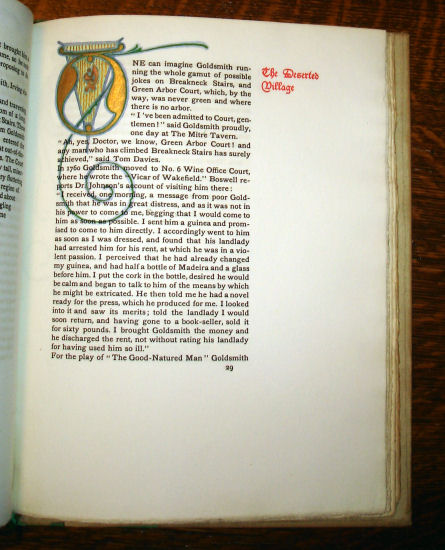
This screenshot has height=550, width=445. I want to click on table, so click(436, 291).